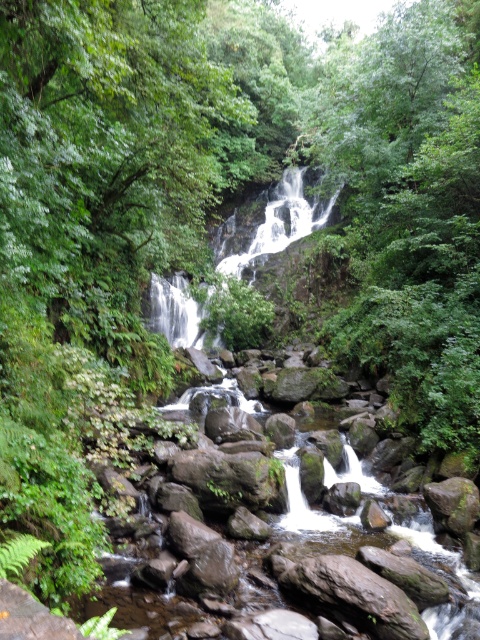
You are a hiker who wants to cross the white smooth waterfall at center. You notice a green mossy rock at center nearby. Considering their sizes, which object would provide a more stable footing for stepping on?

The green mossy rock at center has a larger size compared to the white smooth waterfall at center, so it would provide more stable footing for stepping on.